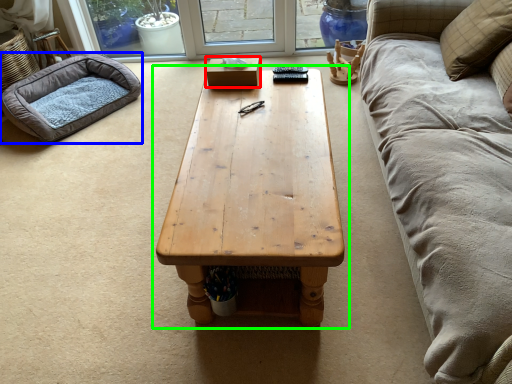
Question: Which object is positioned closest to box (highlighted by a red box)? Select from dog bed (highlighted by a blue box) and coffee table (highlighted by a green box).

Choices:
 (A) dog bed
 (B) coffee table

Answer: (B)